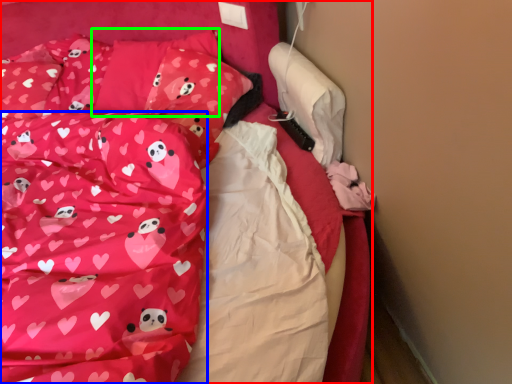
Question: Considering the real-world distances, which object is farthest from bed (highlighted by a red box)? blanket (highlighted by a blue box) or pillow (highlighted by a green box)?

Choices:
 (A) blanket
 (B) pillow

Answer: (A)